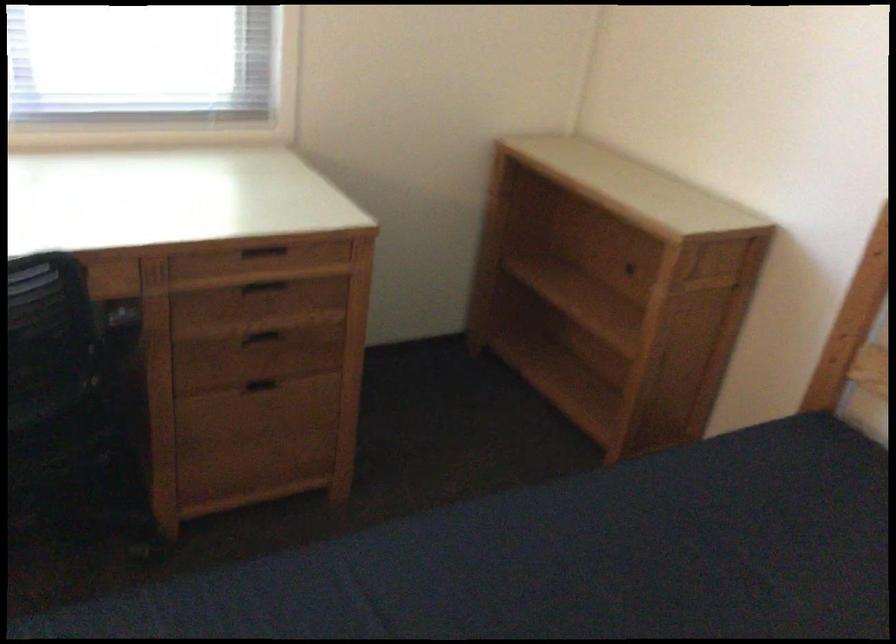
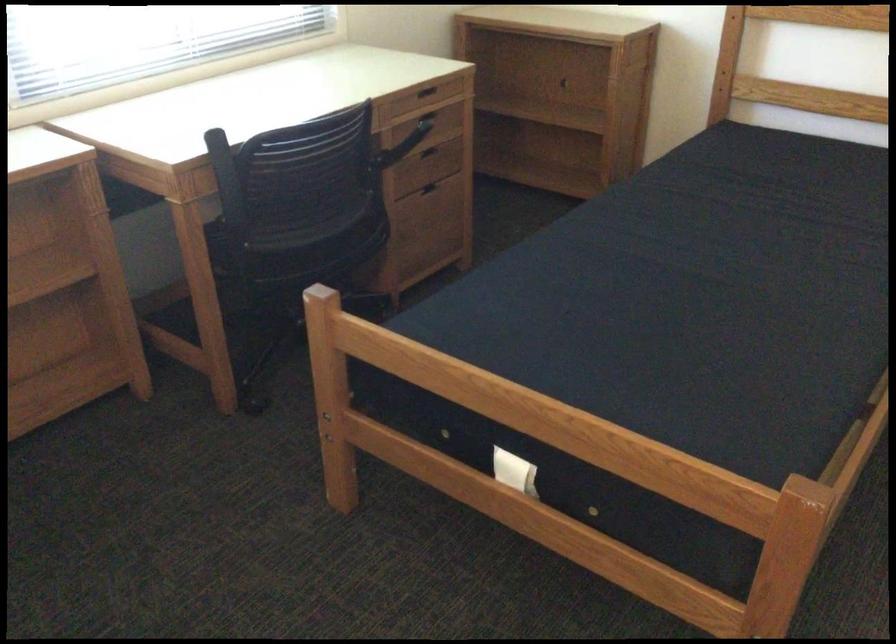
In the second image, find the point that corresponds to point (259, 251) in the first image.

(424, 91)